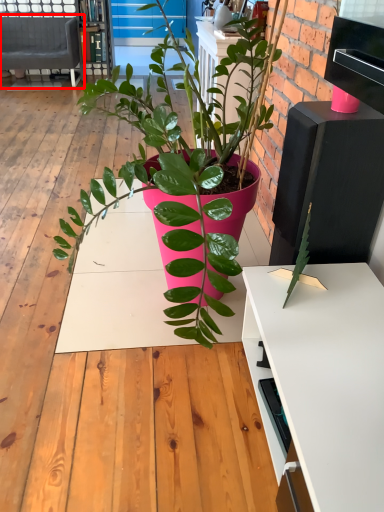
Question: From the image's perspective, where is studio couch (annotated by the red box) located in relation to bookshelf in the image?

Choices:
 (A) above
 (B) below

Answer: (B)